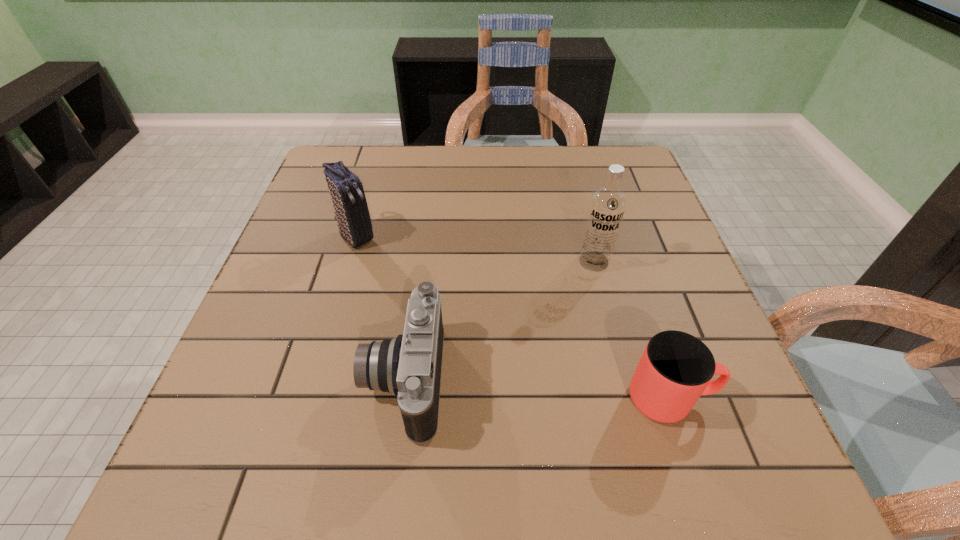
You are a GUI agent. You are given a task and a screenshot of the screen. Output one action in this format:
    pyautogui.click(x=<x>, y=<y>)
    Task: Click on the vacant space that satisfies the following two spatial constraints: 1. on the front side of the second shortest object; 2. on the front-facing side of the second tallest object
    This screenshot has width=960, height=540.
    Given the screenshot: What is the action you would take?
    pyautogui.click(x=315, y=380)